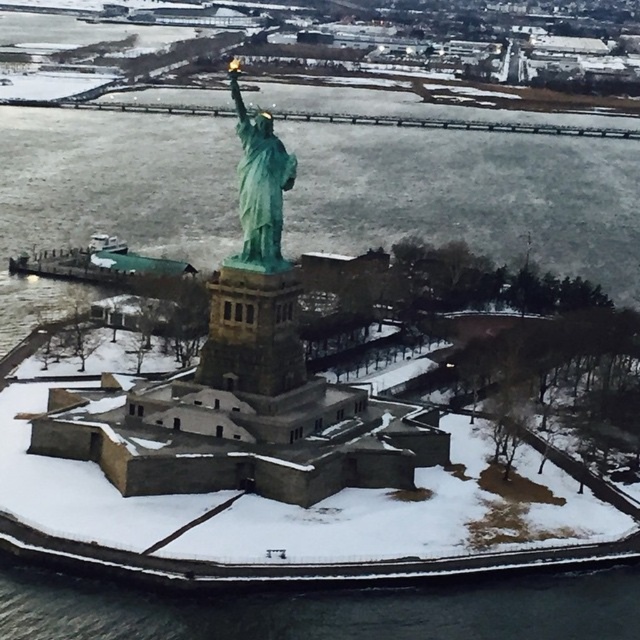
Question: Which of the following is the farthest from the observer?

Choices:
 (A) black water at lower center
 (B) green patina statue at center

Answer: (B)

Question: Considering the relative positions of black water at lower center and green patina statue at center in the image provided, where is black water at lower center located with respect to green patina statue at center?

Choices:
 (A) above
 (B) below

Answer: (B)

Question: Which object appears closest to the camera in this image?

Choices:
 (A) green patina statue at center
 (B) black water at lower center

Answer: (B)

Question: Does black water at lower center lie behind green patina statue at center?

Choices:
 (A) yes
 (B) no

Answer: (B)

Question: Which of the following is the closest to the observer?

Choices:
 (A) green patina statue at center
 (B) black water at lower center

Answer: (B)

Question: Considering the relative positions of black water at lower center and green patina statue at center in the image provided, where is black water at lower center located with respect to green patina statue at center?

Choices:
 (A) right
 (B) left

Answer: (A)